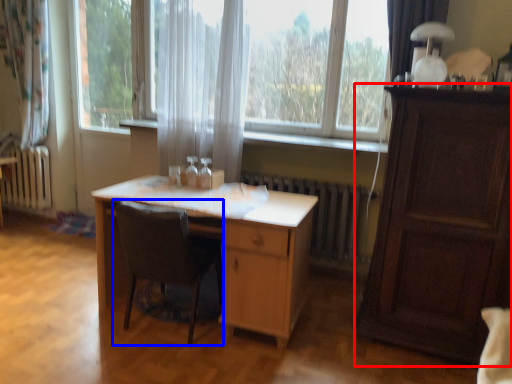
Question: Which object is further to the camera taking this photo, cabinetry (highlighted by a red box) or chair (highlighted by a blue box)?

Choices:
 (A) cabinetry
 (B) chair

Answer: (B)